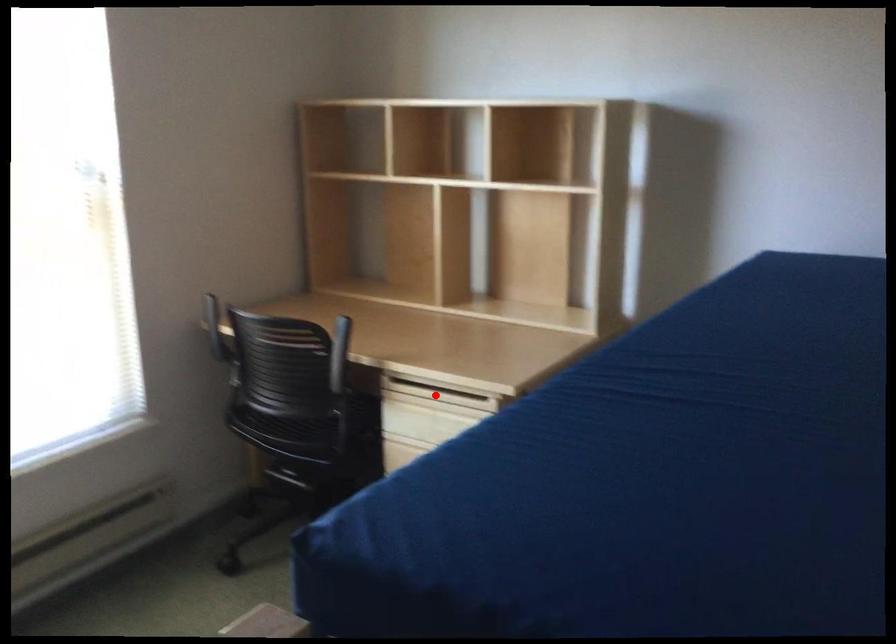
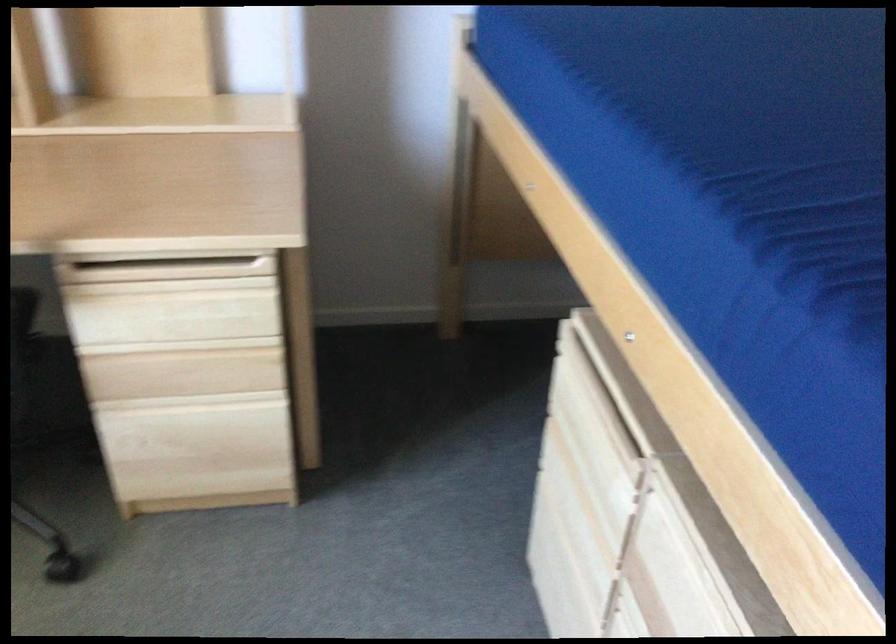
Where in the second image is the point corresponding to the highlighted location from the first image?

(166, 270)